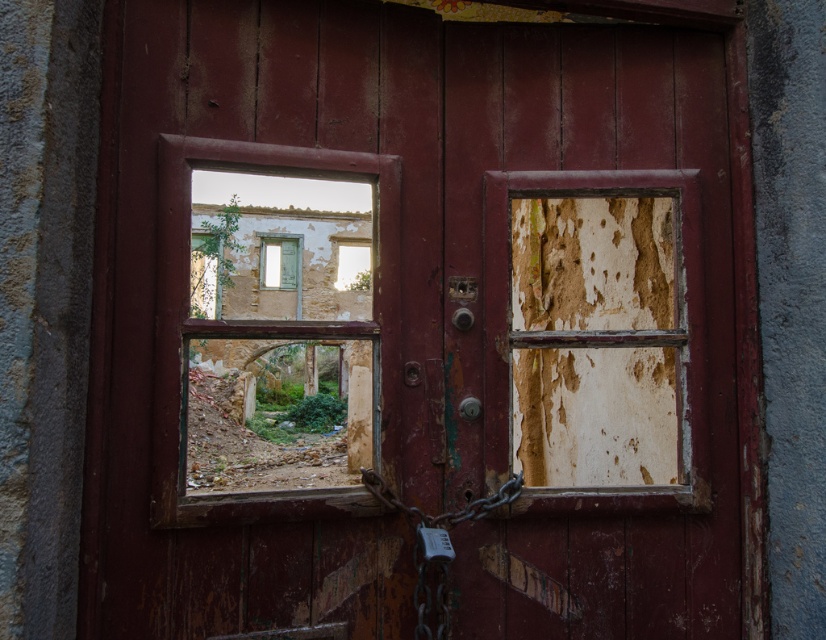
Question: Which object appears closest to the camera in this image?

Choices:
 (A) peeling paint window at center
 (B) cracked glass window at upper center
 (C) rusty metal chain at center

Answer: (C)

Question: Which point is farther to the camera?

Choices:
 (A) rusty metal chain at center
 (B) wooden window at center

Answer: (B)

Question: Does rusty metal chain at center have a greater width compared to metallic silver lock at lower center?

Choices:
 (A) yes
 (B) no

Answer: (A)

Question: Can you confirm if wooden window at center is positioned to the left of peeling paint window at center?

Choices:
 (A) no
 (B) yes

Answer: (B)

Question: Can you confirm if rusty metal chain at center is wider than cracked glass window at upper center?

Choices:
 (A) yes
 (B) no

Answer: (B)

Question: Which point appears farthest from the camera in this image?

Choices:
 (A) [260, 502]
 (B) [416, 536]
 (C) [559, 196]
 (D) [276, 278]

Answer: (D)